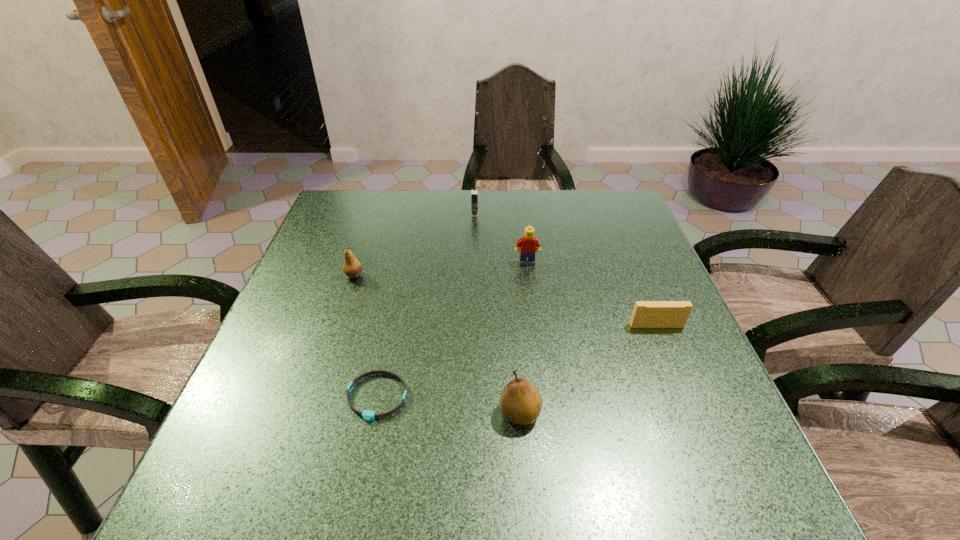
Locate an element on the screen. This screenshot has width=960, height=540. vacant space at the left edge is located at coordinates click(326, 237).

The width and height of the screenshot is (960, 540). Find the location of `vacant space at the right edge of the desktop`. vacant space at the right edge of the desktop is located at coordinates (664, 380).

This screenshot has height=540, width=960. What are the coordinates of `vacant space at the far left corner of the desktop` in the screenshot? It's located at (334, 228).

You are a GUI agent. You are given a task and a screenshot of the screen. Output one action in this format:
    pyautogui.click(x=<x>, y=<y>)
    Task: Click on the free space at the far right corner of the desktop
    Image resolution: width=960 pixels, height=540 pixels.
    Given the screenshot: What is the action you would take?
    pyautogui.click(x=626, y=229)

Locate an element on the screen. The width and height of the screenshot is (960, 540). vacant space at the near right corner is located at coordinates pos(673,466).

This screenshot has width=960, height=540. I want to click on vacant area between the nearer pear and the second shortest object, so click(x=588, y=369).

Locate an element on the screen. Image resolution: width=960 pixels, height=540 pixels. free spot between the cellular telephone and the left pear is located at coordinates (415, 245).

Where is `vacant area that lies between the right pear and the fifth nearest object`? vacant area that lies between the right pear and the fifth nearest object is located at coordinates (523, 338).

At what (x,y) coordinates should I click in order to perform the action: click on unoccupied area between the farthest object and the Lego. Please return your answer as a coordinate pair (x, y). Image resolution: width=960 pixels, height=540 pixels. Looking at the image, I should click on (501, 239).

In order to click on vacant space that is in between the rightmost object and the shortest object in this screenshot , I will do `click(516, 361)`.